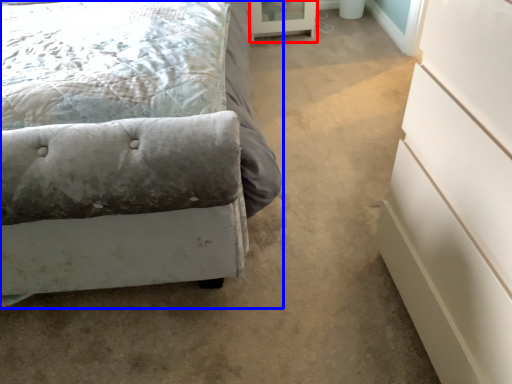
Question: Which object is closer to the camera taking this photo, screen door (highlighted by a red box) or bed (highlighted by a blue box)?

Choices:
 (A) screen door
 (B) bed

Answer: (B)